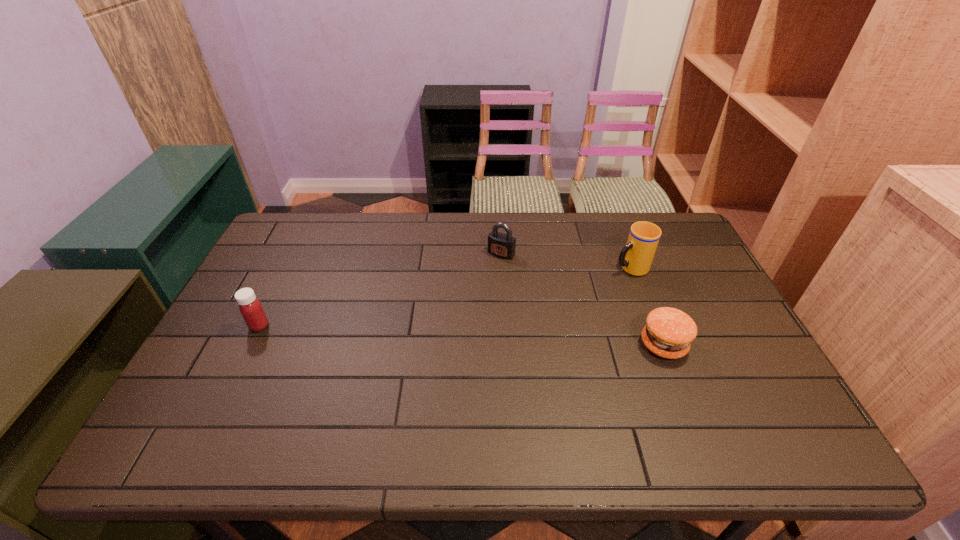
Identify the location of medicine. coord(250,307).

The width and height of the screenshot is (960, 540). In order to click on patty in this screenshot , I will do `click(668, 333)`.

Where is `padlock`? Image resolution: width=960 pixels, height=540 pixels. padlock is located at coordinates (501, 245).

I want to click on cup, so point(636,257).

Image resolution: width=960 pixels, height=540 pixels. What are the coordinates of `vacant space situated on the right of the medicine` in the screenshot? It's located at (396, 326).

Where is `vacant space situated 0.130m on the front of the shortest object`? vacant space situated 0.130m on the front of the shortest object is located at coordinates (689, 409).

Identify the location of free location located on the front of the third object from right to left near the keyhole. (454, 313).

The height and width of the screenshot is (540, 960). I want to click on vacant area located on the front of the third object from right to left near the keyhole, so click(x=463, y=302).

The width and height of the screenshot is (960, 540). I want to click on vacant area situated on the front of the third object from right to left near the keyhole, so click(457, 309).

Find the location of `free space located on the side of the tallest object with the handle`. free space located on the side of the tallest object with the handle is located at coordinates (557, 294).